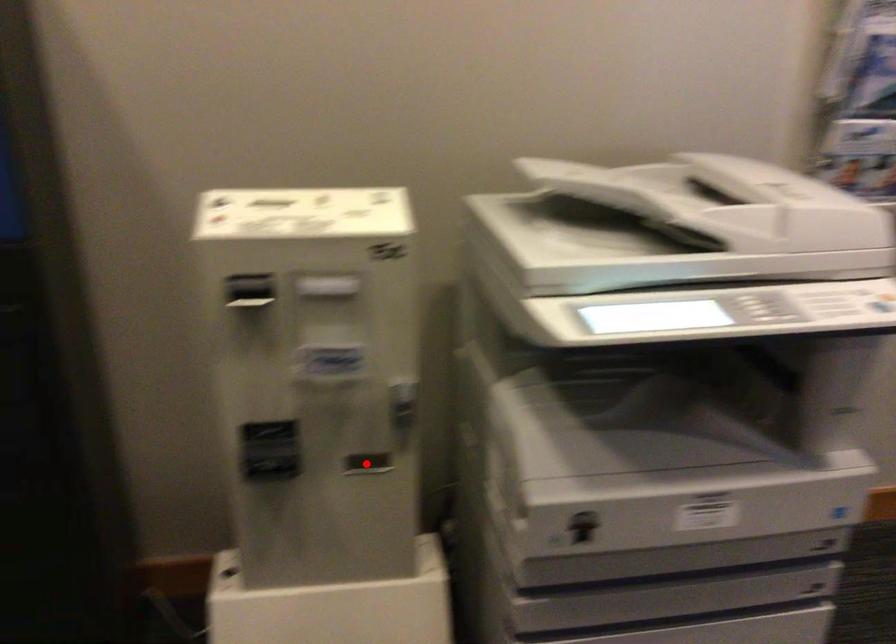
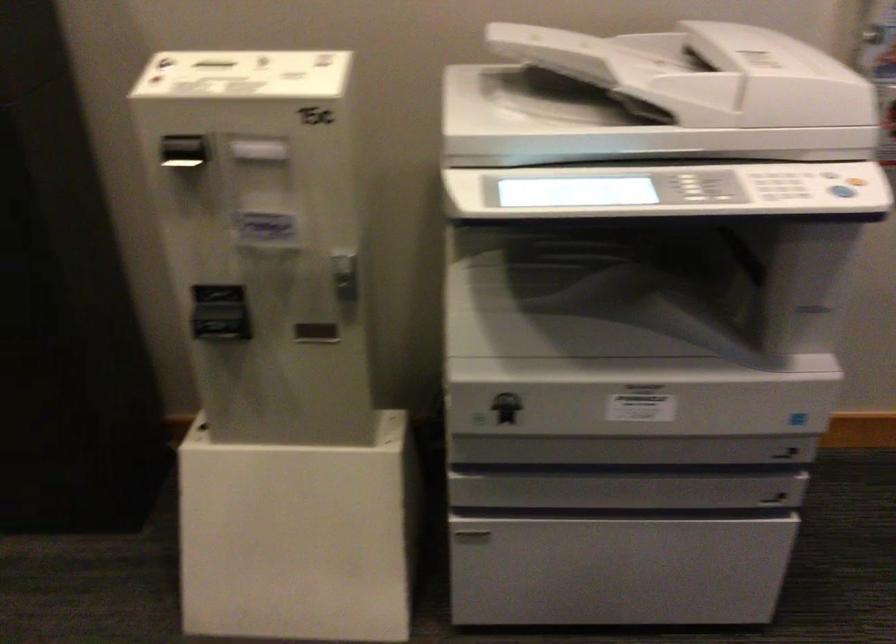
Locate, in the second image, the point that corresponds to the highlighted location in the first image.

(315, 333)